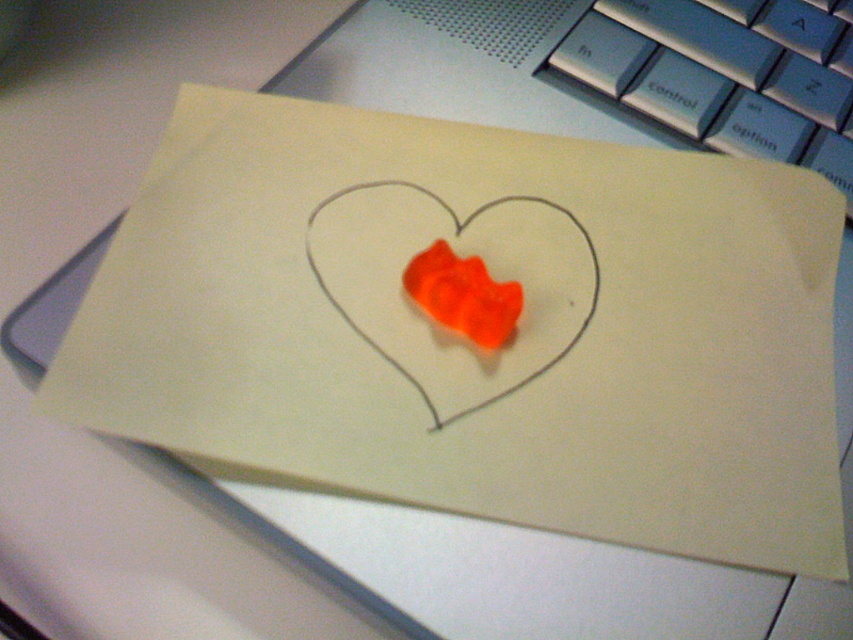
You are trying to determine if the orange gelatinous heart at center can fit inside the translucent orange gummy bear at center based on their sizes. According to the scene description, which one is wider?

The orange gelatinous heart at center is wider than the translucent orange gummy bear at center, so it cannot fit inside the latter.

You are organizing items on a desk and need to place both the orange gelatinous heart at center and the translucent orange gummy bear at center into a box. If the box has a height limit of 3 centimeters, which item might not fit and why?

The orange gelatinous heart at center has a greater height compared to the translucent orange gummy bear at center, so it might not fit into the box if its height exceeds 3 centimeters.

You are holding a camera and want to take a photo of the orange gelatinous heart at center. The camera requires a minimum distance of 20 inches to focus properly. Can you take a clear photo without moving the camera closer?

The orange gelatinous heart at center and camera are 20.11 inches apart from each other, so yes, you can take a clear photo without moving the camera closer since the distance meets the minimum requirement.